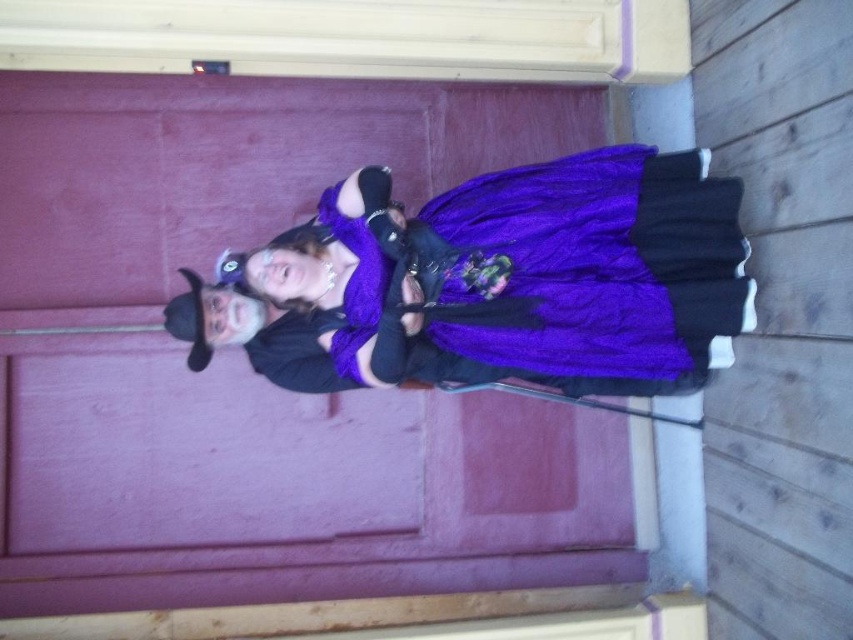
You are standing in front of a large maroon door with a light wooden frame. There are two people in costumes nearby. Where exactly is the purple matte door at center located?

The purple matte door at center is located at point [286,484].

You are a painter standing 10 feet away from the purple matte door at center and the purple velvet dress at center. You want to paint both subjects but can only focus on one at a time. Which one should you paint first if you want to capture the closest subject first?

The purple velvet dress at center is closer to you than the purple matte door at center since it is only 19.80 inches away from the door. Therefore, you should paint the purple velvet dress at center first.

You are a guest at a costume party and see the purple matte door at center and the purple velvet dress at center. Which object is closer to you?

The purple matte door at center is closer to you because the purple velvet dress at center is behind it.